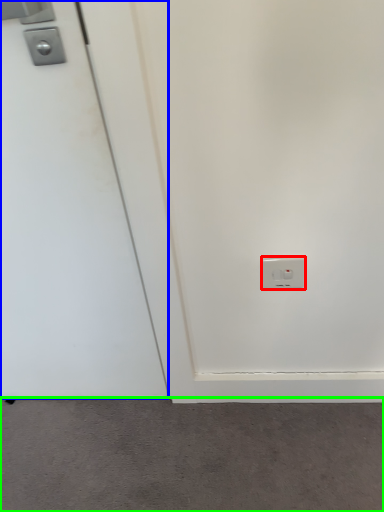
Question: Which is nearer to the power plugs and sockets (highlighted by a red box)? door (highlighted by a blue box) or concrete (highlighted by a green box).

Choices:
 (A) door
 (B) concrete

Answer: (A)